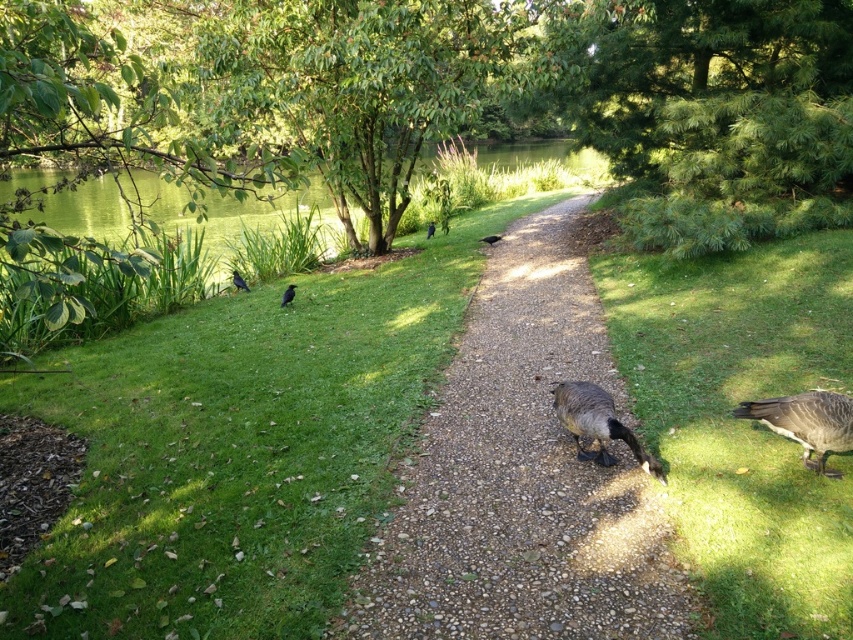
Looking at this image, which is below, green grass at lower right or dark gray feathered duck at lower right?

dark gray feathered duck at lower right is below.

Looking at this image, between green grass at lower right and dark gray feathered duck at lower right, which one is positioned higher?

green grass at lower right

Locate an element on the screen. green grass at lower right is located at coordinates (740, 419).

Can you confirm if smooth gravel path at center is thinner than shiny black bird at center?

No, smooth gravel path at center is not thinner than shiny black bird at center.

Is smooth gravel path at center below shiny black bird at center?

Yes, smooth gravel path at center is below shiny black bird at center.

I want to click on smooth gravel path at center, so click(x=521, y=476).

Between smooth gravel path at center and dark gray feathered duck at center, which one is positioned lower?

dark gray feathered duck at center

How far apart are smooth gravel path at center and dark gray feathered duck at center?

They are 26.64 inches apart.

Who is more distant from viewer, (x=537, y=268) or (x=555, y=404)?

Positioned behind is point (x=537, y=268).

Identify the location of smooth gravel path at center. This screenshot has width=853, height=640. (521, 476).